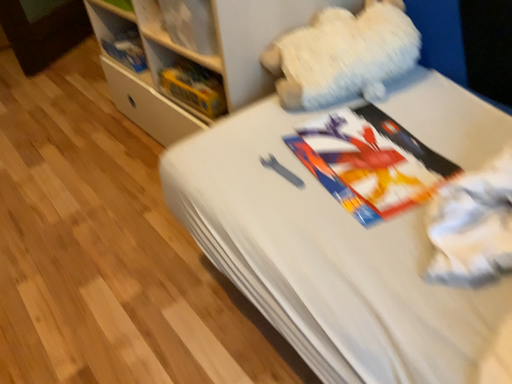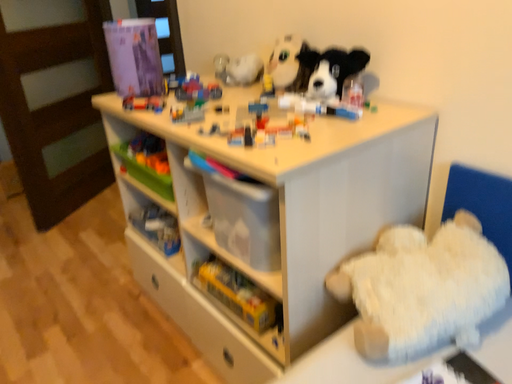
Question: How did the camera likely rotate when shooting the video?

Choices:
 (A) rotated downward
 (B) rotated upward

Answer: (B)